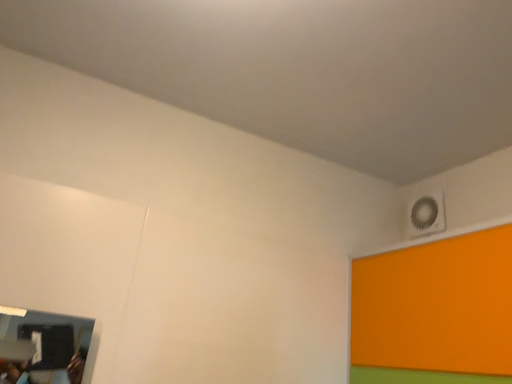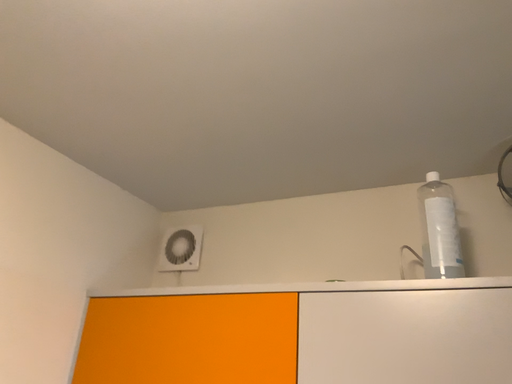
Question: Which way did the camera rotate in the video?

Choices:
 (A) rotated right
 (B) rotated left

Answer: (A)